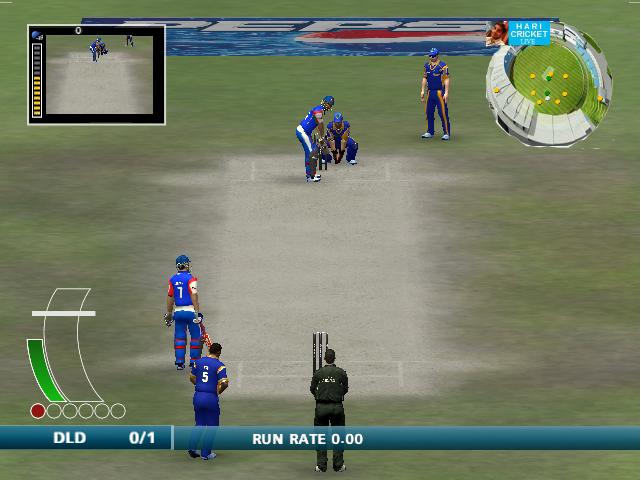
The width and height of the screenshot is (641, 480). Identify the location of picture in picture inset. (117, 78).